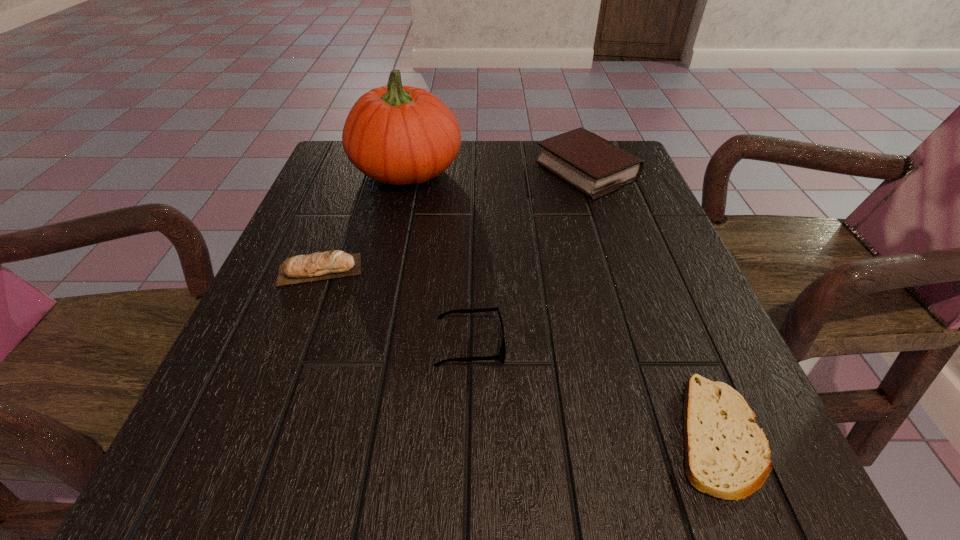
Locate an element on the screen. unoccupied area between the second tallest object and the fourth farthest object is located at coordinates (528, 258).

Where is `vacant space in between the nearer pita bread and the tallest object`? vacant space in between the nearer pita bread and the tallest object is located at coordinates (562, 303).

You are a GUI agent. You are given a task and a screenshot of the screen. Output one action in this format:
    pyautogui.click(x=<x>, y=<y>)
    Task: Click on the free area in between the taller pita bread and the shorter pita bread
    This screenshot has width=960, height=540.
    Given the screenshot: What is the action you would take?
    coord(518,353)

The height and width of the screenshot is (540, 960). In order to click on vacant space in between the pumpkin and the third farthest object in this screenshot , I will do `click(364, 220)`.

Where is `vacant space in between the second tallest object and the farther pita bread`? vacant space in between the second tallest object and the farther pita bread is located at coordinates (453, 221).

This screenshot has width=960, height=540. I want to click on vacant point located between the tallest object and the left pita bread, so click(364, 220).

Where is `vacant space that's between the left pita bread and the Bible`? This screenshot has height=540, width=960. vacant space that's between the left pita bread and the Bible is located at coordinates (453, 221).

Find the location of a particular element. The image size is (960, 540). empty space that is in between the tallest object and the sunglasses is located at coordinates (439, 257).

Select which object is the second closest to the Bible. Please provide its 2D coordinates. Your answer should be formatted as a tuple, i.e. [(x, y)], where the tuple contains the x and y coordinates of a point satisfying the conditions above.

[(502, 353)]

This screenshot has height=540, width=960. I want to click on object that stands as the fourth closest to the Bible, so click(x=727, y=455).